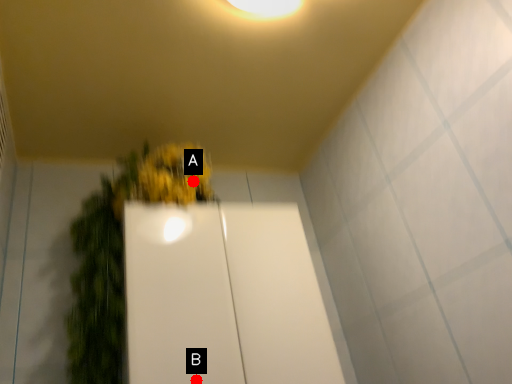
Question: Two points are circled on the image, labeled by A and B beside each circle. Which point is further to the camera?

Choices:
 (A) A is further
 (B) B is further

Answer: (A)